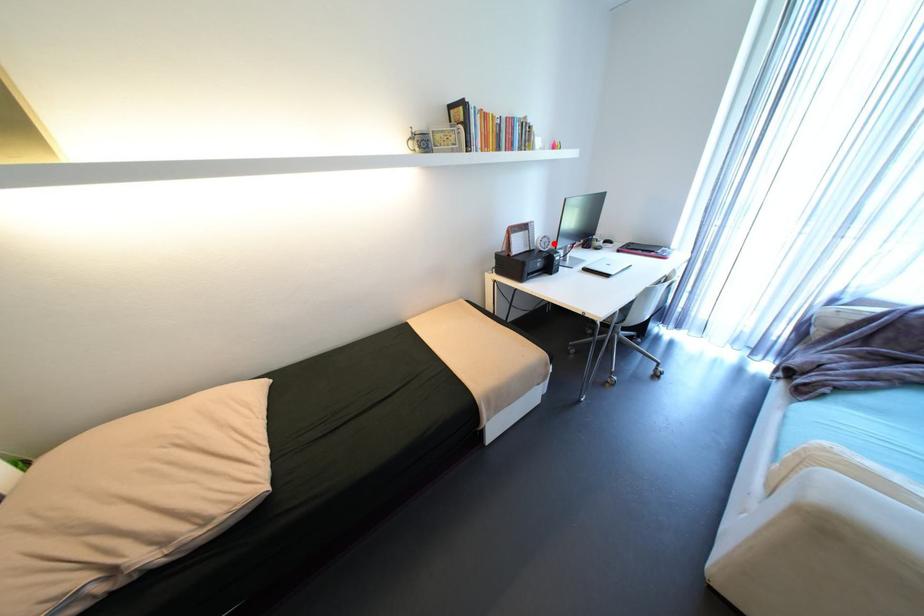
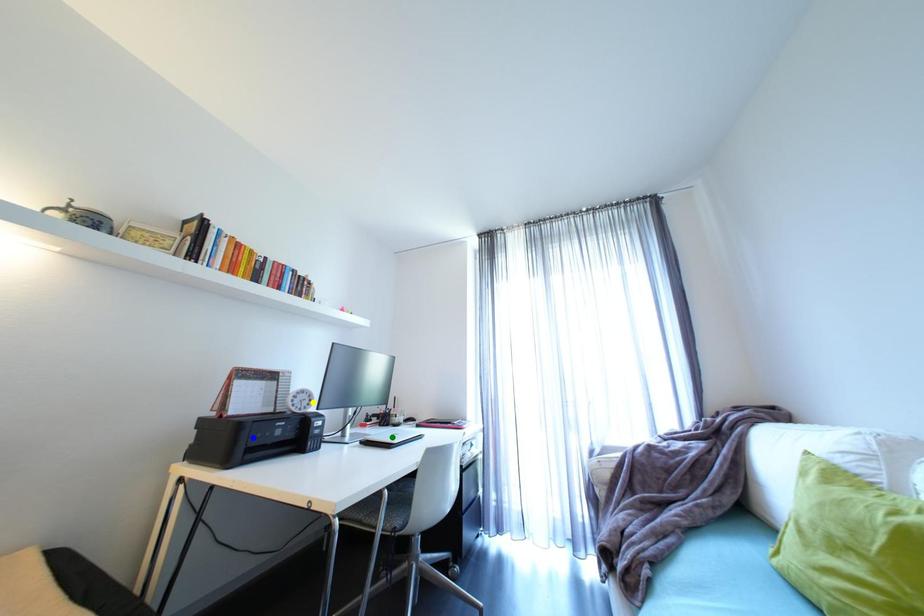
Question: I am providing you with two images of the same scene from different viewpoints. A red point is marked on the first image. You are given multiple points on the second image. Which point in image 2 represents the same 3d spot as the red point in image 1?

Choices:
 (A) yellow point
 (B) green point
 (C) blue point

Answer: (A)